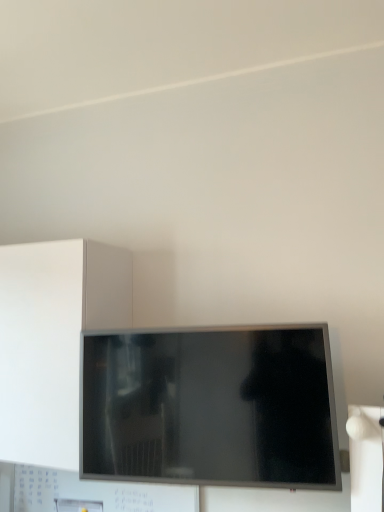
This screenshot has height=512, width=384. In order to click on matte black tv at center in this screenshot , I will do `click(210, 407)`.

The width and height of the screenshot is (384, 512). Describe the element at coordinates (210, 407) in the screenshot. I see `matte black tv at center` at that location.

The image size is (384, 512). I want to click on white matte cabinet at left, so click(53, 340).

What is the approximate width of white matte cabinet at left?

The width of white matte cabinet at left is 16.40 inches.

What do you see at coordinates (53, 340) in the screenshot? This screenshot has width=384, height=512. I see `white matte cabinet at left` at bounding box center [53, 340].

The width and height of the screenshot is (384, 512). Find the location of `matte black tv at center`. matte black tv at center is located at coordinates (210, 407).

Is white matte cabinet at left to the left of matte black tv at center from the viewer's perspective?

Indeed, white matte cabinet at left is positioned on the left side of matte black tv at center.

Which object is further away from the camera, white matte cabinet at left or matte black tv at center?

Positioned behind is white matte cabinet at left.

Which is closer to the camera, (53, 361) or (308, 426)?

The point (308, 426) is in front.

From the image's perspective, which one is positioned lower, white matte cabinet at left or matte black tv at center?

matte black tv at center, from the image's perspective.

From a real-world perspective, relative to matte black tv at center, is white matte cabinet at left vertically above or below?

From a real-world perspective, white matte cabinet at left is physically above matte black tv at center.

Considering the sizes of white matte cabinet at left and matte black tv at center in the image, is white matte cabinet at left wider or thinner than matte black tv at center?

Considering their sizes, white matte cabinet at left looks broader than matte black tv at center.

From the picture: Does white matte cabinet at left have a greater height compared to matte black tv at center?

Indeed, white matte cabinet at left has a greater height compared to matte black tv at center.

Which of these two, white matte cabinet at left or matte black tv at center, is bigger?

Bigger between the two is white matte cabinet at left.

Can matte black tv at center be found inside white matte cabinet at left?

No, matte black tv at center is not inside white matte cabinet at left.

Would you say white matte cabinet at left is a long distance from matte black tv at center?

white matte cabinet at left is near matte black tv at center, not far away.

Is white matte cabinet at left looking in the opposite direction of matte black tv at center?

That's not correct — white matte cabinet at left is not looking away from matte black tv at center.

Can you tell me how much white matte cabinet at left and matte black tv at center differ in facing direction?

The angular difference between white matte cabinet at left and matte black tv at center is 7.8 degrees.

Identify the location of cabinetry that appears on the left of matte black tv at center. (53, 340).

Considering the relative positions of matte black tv at center and white matte cabinet at left in the image provided, is matte black tv at center to the right of white matte cabinet at left from the viewer's perspective?

Correct, you'll find matte black tv at center to the right of white matte cabinet at left.

Which object is closer to the camera taking this photo, matte black tv at center or white matte cabinet at left?

matte black tv at center is closer to the camera.

Considering the points (288, 356) and (54, 305), which point is in front, point (288, 356) or point (54, 305)?

Positioned in front is point (288, 356).

From the image's perspective, which one is positioned higher, matte black tv at center or white matte cabinet at left?

white matte cabinet at left appears higher in the image.

From a real-world perspective, is matte black tv at center positioned under white matte cabinet at left based on gravity?

Indeed, from a real-world perspective, matte black tv at center is positioned beneath white matte cabinet at left.

Between matte black tv at center and white matte cabinet at left, which one has smaller width?

matte black tv at center.

Does matte black tv at center have a lesser height compared to white matte cabinet at left?

Indeed, matte black tv at center has a lesser height compared to white matte cabinet at left.

Between matte black tv at center and white matte cabinet at left, which one has smaller size?

matte black tv at center.

Would you say matte black tv at center is inside or outside white matte cabinet at left?

matte black tv at center is located beyond the bounds of white matte cabinet at left.

Is matte black tv at center directly adjacent to white matte cabinet at left?

No.

Does matte black tv at center turn towards white matte cabinet at left?

No.

What's the angular difference between matte black tv at center and white matte cabinet at left's facing directions?

7.8 degrees separate the facing orientations of matte black tv at center and white matte cabinet at left.

At what (x,y) coordinates should I click in order to perform the action: click on cabinetry on the left of matte black tv at center. Please return your answer as a coordinate pair (x, y). The image size is (384, 512). Looking at the image, I should click on (53, 340).

Where is `cabinetry behind the matte black tv at center`? This screenshot has width=384, height=512. cabinetry behind the matte black tv at center is located at coordinates (53, 340).

In order to click on television in front of the white matte cabinet at left in this screenshot , I will do `click(210, 407)`.